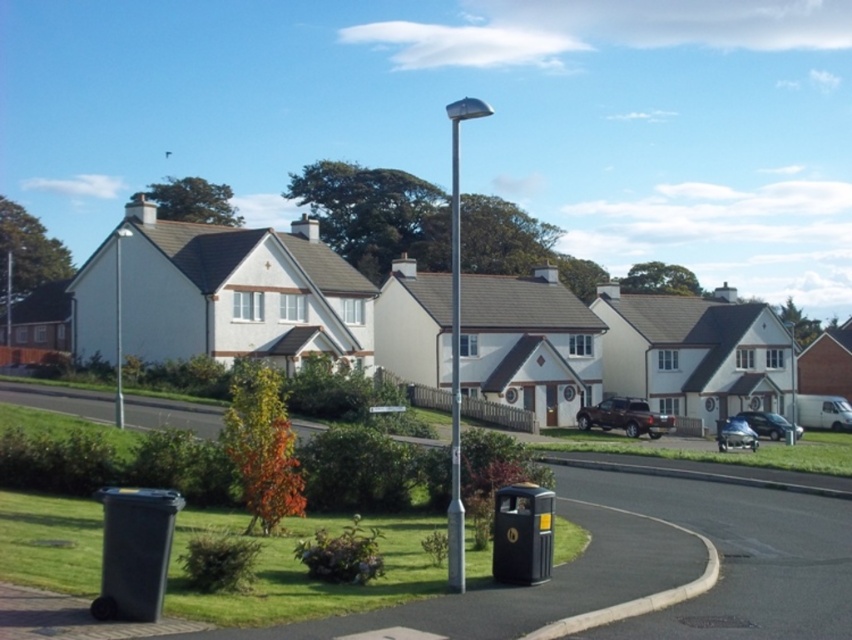
You are driving a shiny silver car at center and want to park it in the driveway behind the metallic silver pole at center. Can you maneuver the car to that spot without hitting the pole?

The metallic silver pole at center is in front of the shiny silver car at center, so the pole is blocking the path to the driveway behind it. You would need to move the pole first before parking the car there.

You are standing at the entrance of the suburban residential area and notice a silver metallic pole at center. According to the coordinates provided, where exactly is the silver metallic pole located in relation to the paved road and the grassy median strip?

The silver metallic pole at center is located at point coordinates 0.542 on the x axis and 0.536 on the y axis, which places it centrally positioned over the grassy median strip between the paved road and the tree with autumn leaves.